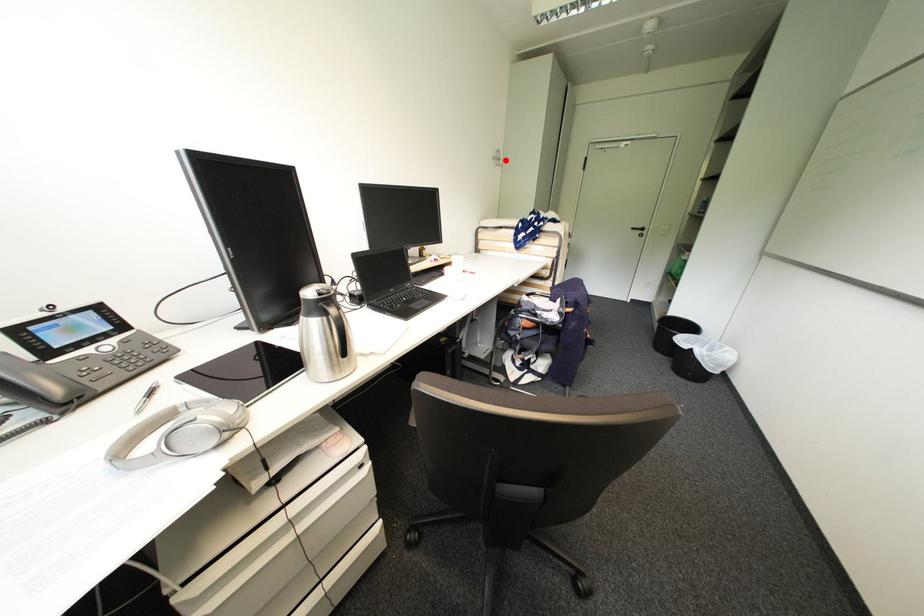
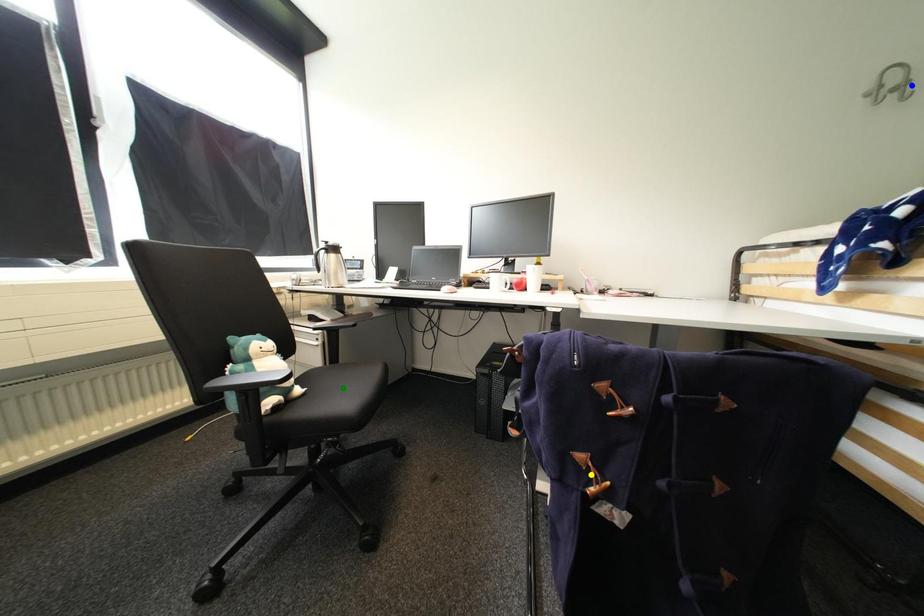
Question: I am providing you with two images of the same scene from different viewpoints. A red point is marked on the first image. You are given multiple points on the second image. Which spot in image 2 lines up with the point in image 1?

Choices:
 (A) blue point
 (B) yellow point
 (C) green point

Answer: (A)